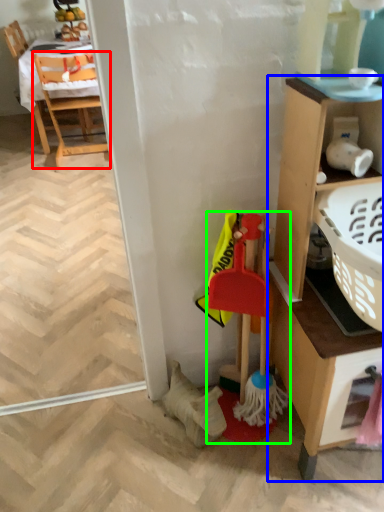
Question: Based on their relative distances, which object is nearer to chair (highlighted by a red box)? Choose from cabinetry (highlighted by a blue box) and toy (highlighted by a green box).

Choices:
 (A) cabinetry
 (B) toy

Answer: (B)